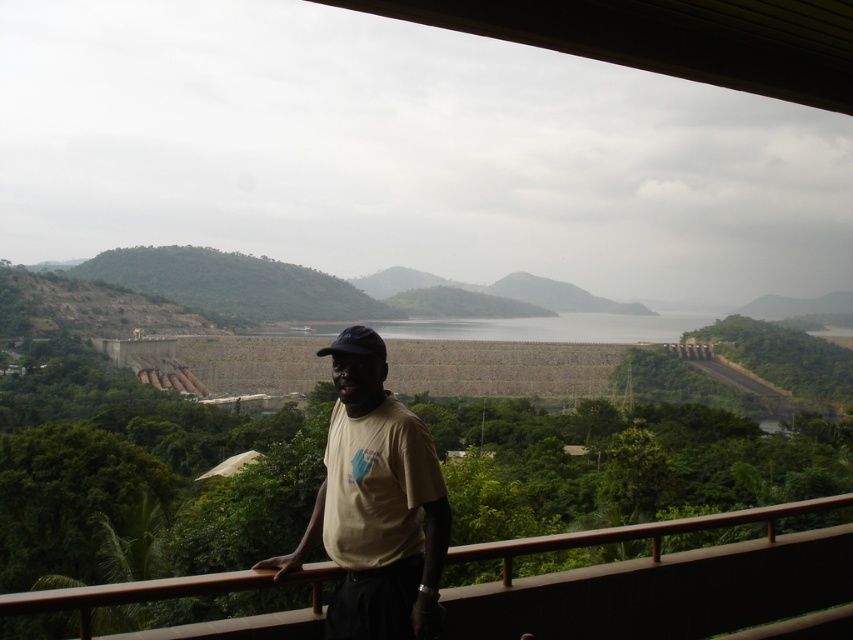
Question: Does beige cotton t-shirt at center appear on the right side of brown wooden railing at lower center?

Choices:
 (A) no
 (B) yes

Answer: (B)

Question: Can you confirm if beige cotton t-shirt at center is positioned to the right of brown wooden railing at lower center?

Choices:
 (A) no
 (B) yes

Answer: (B)

Question: Does beige cotton t-shirt at center have a lesser width compared to brown wooden railing at lower center?

Choices:
 (A) yes
 (B) no

Answer: (A)

Question: Among these points, which one is nearest to the camera?

Choices:
 (A) (419, 476)
 (B) (231, 586)

Answer: (B)

Question: Among these points, which one is nearest to the camera?

Choices:
 (A) (589, 531)
 (B) (415, 467)

Answer: (B)